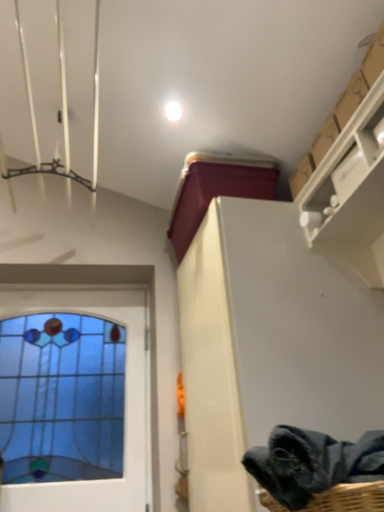
The height and width of the screenshot is (512, 384). What are the coordinates of `dark gray fabric at lower right` in the screenshot? It's located at (312, 463).

Measure the distance between stained glass window at left and camera.

stained glass window at left is 5.71 feet away from camera.

What do you see at coordinates (125, 401) in the screenshot?
I see `stained glass window at left` at bounding box center [125, 401].

You are a GUI agent. You are given a task and a screenshot of the screen. Output one action in this format:
    pyautogui.click(x=<x>, y=<y>)
    Task: Click on the white glossy droplight at upper center
    This screenshot has width=384, height=512.
    Given the screenshot: What is the action you would take?
    pyautogui.click(x=173, y=111)

From a real-world perspective, between white glossy droplight at upper center and cardboard at upper right, who is vertically lower?

cardboard at upper right, from a real-world perspective.

Based on the photo, is white glossy droplight at upper center not near cardboard at upper right?

No, white glossy droplight at upper center is in close proximity to cardboard at upper right.

Considering the positions of point (174, 102) and point (320, 167), is point (174, 102) closer or farther from the camera than point (320, 167)?

Point (174, 102) is farther from the camera than point (320, 167).

Which object is closer to the camera, white glossy droplight at upper center or cardboard at upper right?

cardboard at upper right is more forward.

Is cardboard at upper right positioned with its back to dark gray fabric at lower right?

No, cardboard at upper right's orientation is not away from dark gray fabric at lower right.

Is cardboard at upper right located outside dark gray fabric at lower right?

Yes, cardboard at upper right is not within dark gray fabric at lower right.

From their relative heights in the image, would you say cardboard at upper right is taller or shorter than dark gray fabric at lower right?

Clearly, cardboard at upper right is taller compared to dark gray fabric at lower right.

Do you think white glossy droplight at upper center is within dark gray fabric at lower right, or outside of it?

white glossy droplight at upper center is not enclosed by dark gray fabric at lower right.

Which object is further away from the camera taking this photo, white glossy droplight at upper center or dark gray fabric at lower right?

white glossy droplight at upper center is more distant.

Is white glossy droplight at upper center thinner than dark gray fabric at lower right?

Correct, the width of white glossy droplight at upper center is less than that of dark gray fabric at lower right.

How different are the orientations of white glossy droplight at upper center and dark gray fabric at lower right in degrees?

They differ by 87.6 degrees in their facing directions.

Looking at the image, does dark gray fabric at lower right seem bigger or smaller compared to cardboard at upper right?

Clearly, dark gray fabric at lower right is smaller in size than cardboard at upper right.

The height and width of the screenshot is (512, 384). Identify the location of clothing below the cardboard at upper right (from a real-world perspective). (312, 463).

Is dark gray fabric at lower right looking in the opposite direction of cardboard at upper right?

No, dark gray fabric at lower right is not facing away from cardboard at upper right.

Is dark gray fabric at lower right not close to cardboard at upper right?

dark gray fabric at lower right is near cardboard at upper right, not far away.

Considering the relative sizes of stained glass window at left and cardboard at upper right in the image provided, is stained glass window at left thinner than cardboard at upper right?

Correct, the width of stained glass window at left is less than that of cardboard at upper right.

From the image's perspective, relative to cardboard at upper right, is stained glass window at left above or below?

From the image's perspective, stained glass window at left appears below cardboard at upper right.

Based on the photo, is stained glass window at left looking in the opposite direction of cardboard at upper right?

No.

Would you say stained glass window at left is outside cardboard at upper right?

Indeed, stained glass window at left is completely outside cardboard at upper right.

Between point (372, 431) and point (176, 112), which one is positioned in front?

Positioned in front is point (372, 431).

Between dark gray fabric at lower right and white glossy droplight at upper center, which one has smaller size?

white glossy droplight at upper center is smaller.

From a real-world perspective, which is physically below, dark gray fabric at lower right or white glossy droplight at upper center?

dark gray fabric at lower right.

Is cardboard at upper right to the left of stained glass window at left from the viewer's perspective?

No, cardboard at upper right is not to the left of stained glass window at left.

Is the surface of cardboard at upper right in direct contact with stained glass window at left?

No, cardboard at upper right is not making contact with stained glass window at left.

Considering the sizes of objects cardboard at upper right and stained glass window at left in the image provided, who is wider, cardboard at upper right or stained glass window at left?

Wider between the two is cardboard at upper right.

The image size is (384, 512). What are the coordinates of `shelf in front of the white glossy droplight at upper center` in the screenshot? It's located at (351, 193).

The image size is (384, 512). Identify the location of clothing located on the left of cardboard at upper right. (312, 463).

Based on their spatial positions, is cardboard at upper right or white glossy droplight at upper center further from dark gray fabric at lower right?

white glossy droplight at upper center is further to dark gray fabric at lower right.

When comparing their distances from white glossy droplight at upper center, does dark gray fabric at lower right or cardboard at upper right seem closer?

cardboard at upper right lies closer to white glossy droplight at upper center than the other object.

When comparing their distances from cardboard at upper right, does stained glass window at left or dark gray fabric at lower right seem further?

Based on the image, stained glass window at left appears to be further to cardboard at upper right.

From the image, which object appears to be farther from cardboard at upper right, white glossy droplight at upper center or dark gray fabric at lower right?

dark gray fabric at lower right lies further to cardboard at upper right than the other object.

Based on their spatial positions, is cardboard at upper right or stained glass window at left further from dark gray fabric at lower right?

stained glass window at left is further to dark gray fabric at lower right.

From the image, which object appears to be nearer to stained glass window at left, white glossy droplight at upper center or dark gray fabric at lower right?

white glossy droplight at upper center is positioned closer to the anchor stained glass window at left.

Considering their positions, is stained glass window at left positioned further to cardboard at upper right than white glossy droplight at upper center?

The object further to cardboard at upper right is stained glass window at left.

Based on the photo, from the image, which object appears to be nearer to dark gray fabric at lower right, stained glass window at left or white glossy droplight at upper center?

The object closer to dark gray fabric at lower right is stained glass window at left.

You are a GUI agent. You are given a task and a screenshot of the screen. Output one action in this format:
    pyautogui.click(x=<x>, y=<y>)
    Task: Click on the clothing between white glossy droplight at upper center and stained glass window at left in the up-down direction
    This screenshot has height=512, width=384.
    Given the screenshot: What is the action you would take?
    pyautogui.click(x=312, y=463)

Find the location of a particular element. The width and height of the screenshot is (384, 512). shelf that lies between white glossy droplight at upper center and dark gray fabric at lower right from top to bottom is located at coordinates (351, 193).

What are the coordinates of `clothing between stained glass window at left and cardboard at upper right in the horizontal direction` in the screenshot? It's located at (312, 463).

Image resolution: width=384 pixels, height=512 pixels. In order to click on shelf between white glossy droplight at upper center and stained glass window at left in the up-down direction in this screenshot , I will do `click(351, 193)`.